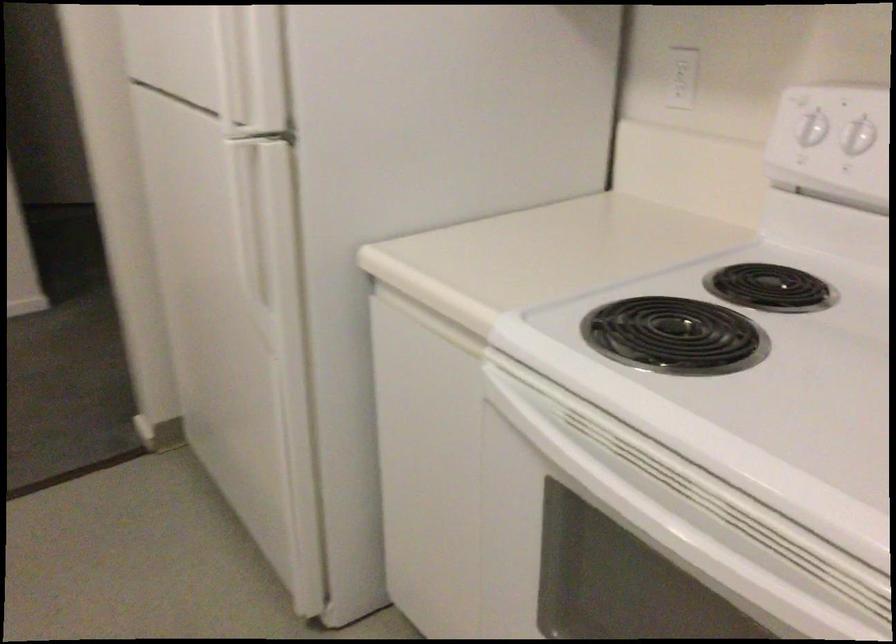
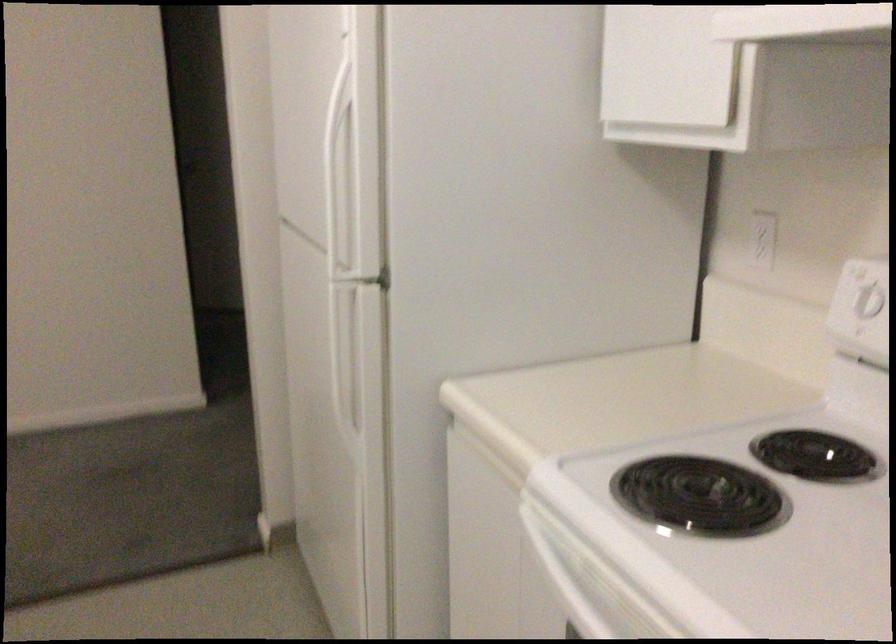
In the second image, find the point that corresponds to (x=252, y=231) in the first image.

(349, 361)